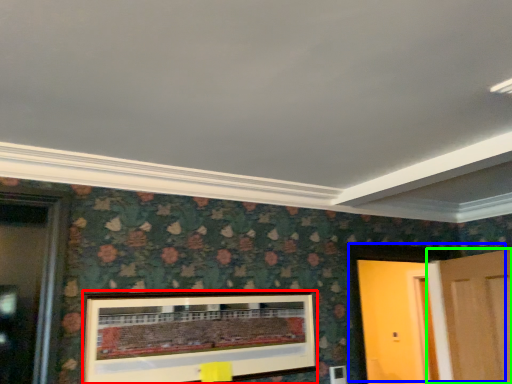
Question: Considering the real-world distances, which object is closest to picture frame (highlighted by a red box)? door (highlighted by a blue box) or door (highlighted by a green box).

Choices:
 (A) door
 (B) door

Answer: (A)